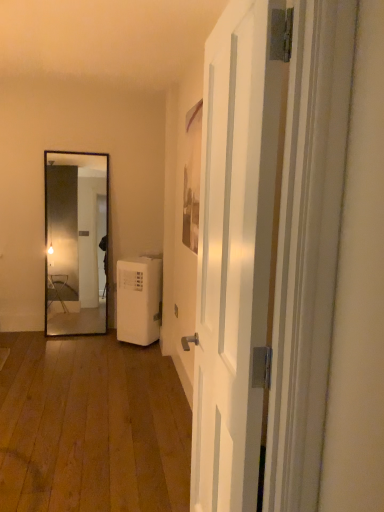
Question: Looking at their shapes, would you say white glossy door at center is wider or thinner than white plastic water heater at lower center?

Choices:
 (A) thin
 (B) wide

Answer: (A)

Question: Is white glossy door at center situated inside white plastic water heater at lower center or outside?

Choices:
 (A) inside
 (B) outside

Answer: (B)

Question: Considering their positions, is white glossy door at center located in front of or behind white plastic water heater at lower center?

Choices:
 (A) behind
 (B) front

Answer: (B)

Question: Is point (125, 309) closer or farther from the camera than point (269, 207)?

Choices:
 (A) closer
 (B) farther

Answer: (B)

Question: Considering the positions of white plastic water heater at lower center and white glossy door at center in the image, is white plastic water heater at lower center wider or thinner than white glossy door at center?

Choices:
 (A) wide
 (B) thin

Answer: (A)

Question: Relative to white glossy door at center, is white plastic water heater at lower center in front or behind?

Choices:
 (A) front
 (B) behind

Answer: (B)

Question: From a real-world perspective, is white plastic water heater at lower center above or below white glossy door at center?

Choices:
 (A) below
 (B) above

Answer: (A)